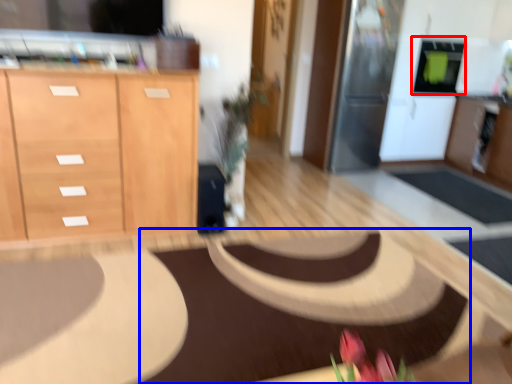
Question: Which of the following is the farthest to the observer, appliance (highlighted by a red box) or mat (highlighted by a blue box)?

Choices:
 (A) appliance
 (B) mat

Answer: (A)